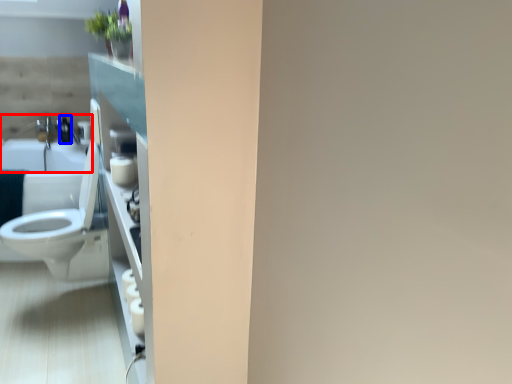
Question: Which of the following is the closest to the observer, sink (highlighted by a red box) or toiletry (highlighted by a blue box)?

Choices:
 (A) sink
 (B) toiletry

Answer: (A)